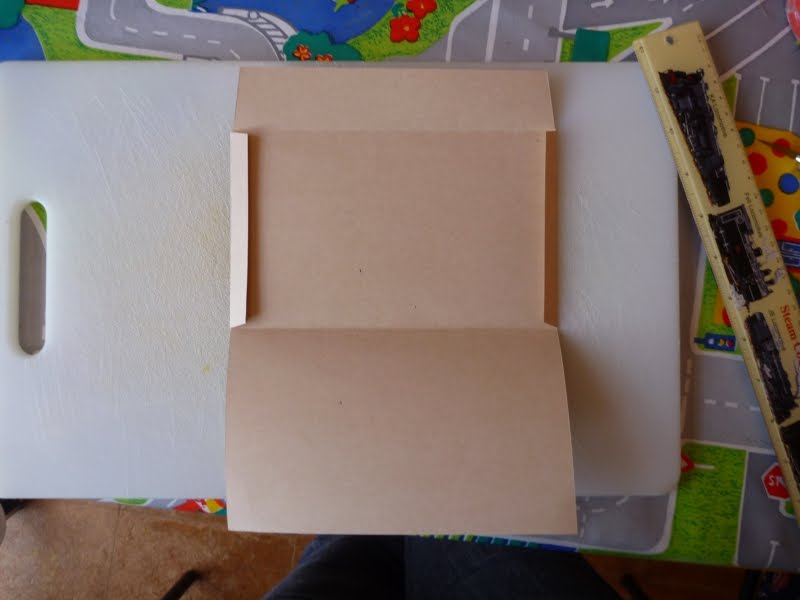
In order to click on hole in cuttijg board in this screenshot , I will do `click(254, 331)`, `click(30, 267)`.